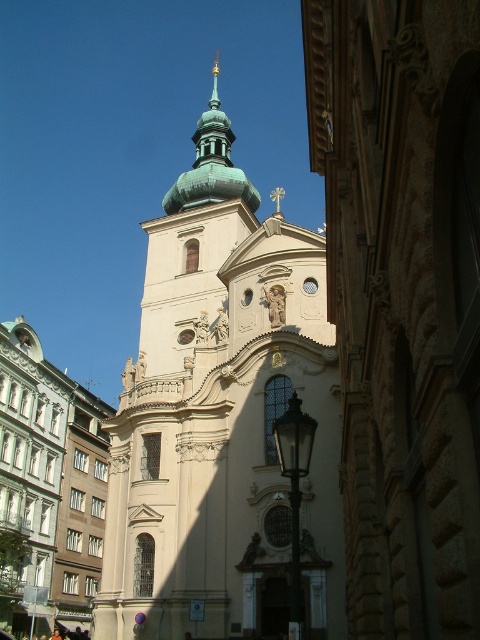
You are an architect designing a new church inspired by Baroque architecture. You have two spire options to place at the upper center of the building. The first is the green polished spire at upper center, and the second is the green polished stone spire at upper center. Which spire is wider?

The green polished spire at upper center is wider than the green polished stone spire at upper center.

You are planning to install a new lighting system for the church. You need to place a light pole between the beige stone tower at center and the green polished spire at upper center. The light pole requires a minimum of 100 feet of space between the two structures to be safely installed. Based on the provided information, is this installation feasible?

The beige stone tower at center and the green polished spire at upper center are 94.75 feet apart from each other. Since 94.75 feet is less than the required 100 feet, the installation is not feasible as there isn not enough space between them.

You are a tourist standing in front of the historic church. You notice two points marked on the facade. The first point is at coordinates point (206,161) and the second is at point (200,124). Which of these points is closer to you as you face the church?

Answer: Point (206,161) is in front of point (200,124), so it is closer to you as you face the church.